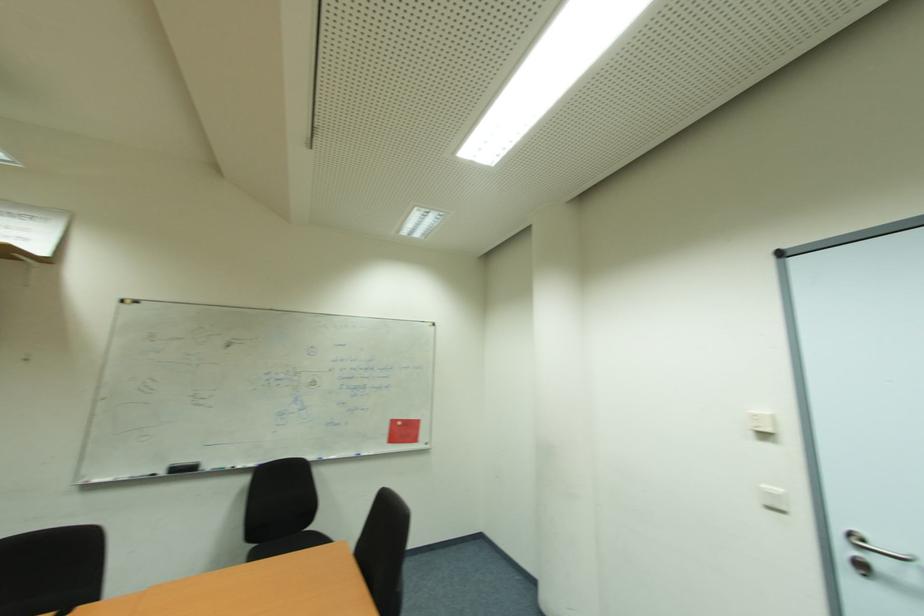
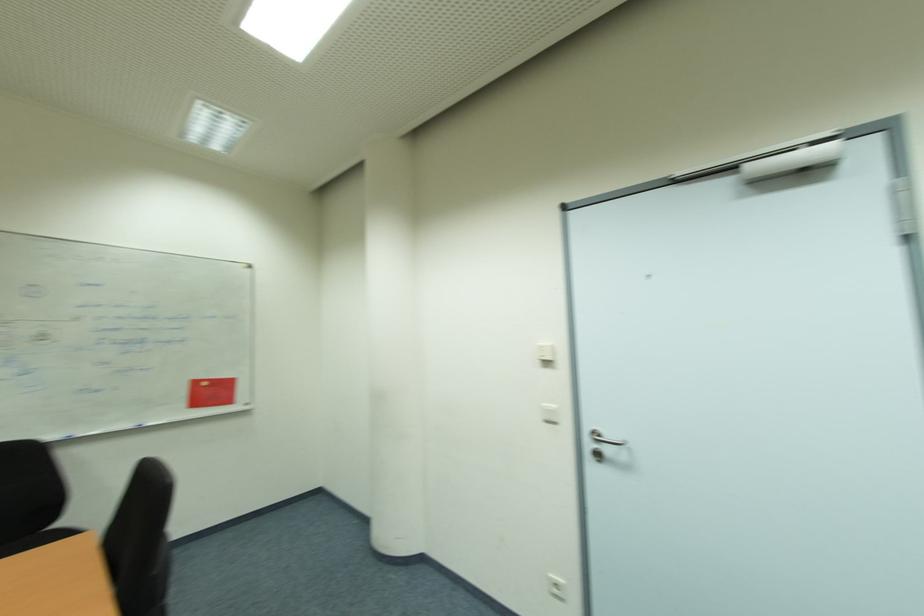
In the second image, find the point that corresponds to [870,543] in the first image.

(602, 436)